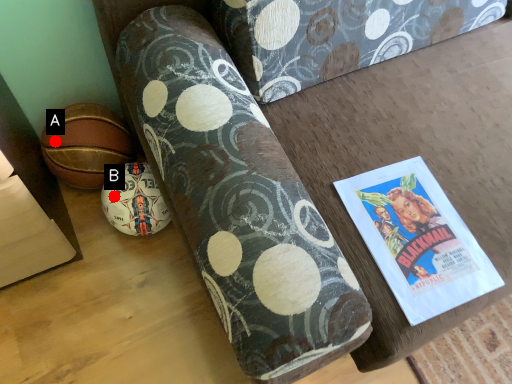
Question: Two points are circled on the image, labeled by A and B beside each circle. Which point is closer to the camera?

Choices:
 (A) A is closer
 (B) B is closer

Answer: (B)